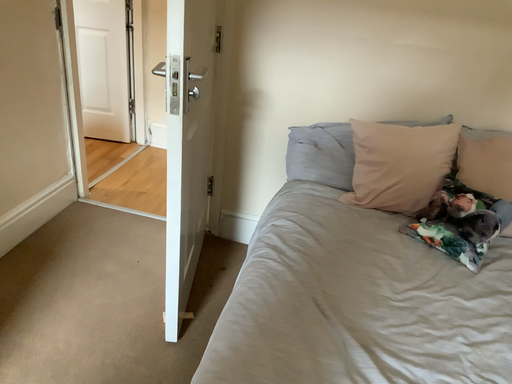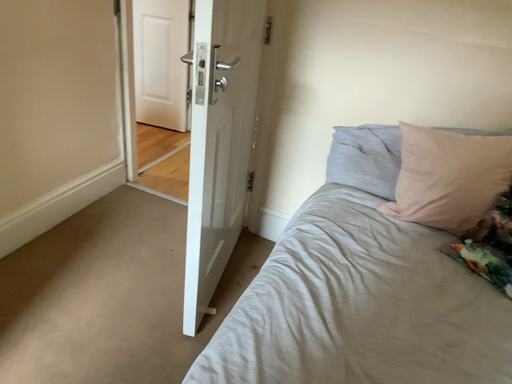
Question: How did the camera likely rotate when shooting the video?

Choices:
 (A) rotated right
 (B) rotated left

Answer: (B)